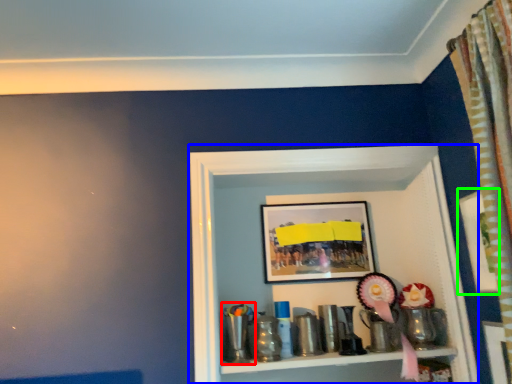
Question: Which object is the closest to the toy (highlighted by a red box)? Choose among these: shelf (highlighted by a blue box) or picture frame (highlighted by a green box).

Choices:
 (A) shelf
 (B) picture frame

Answer: (A)